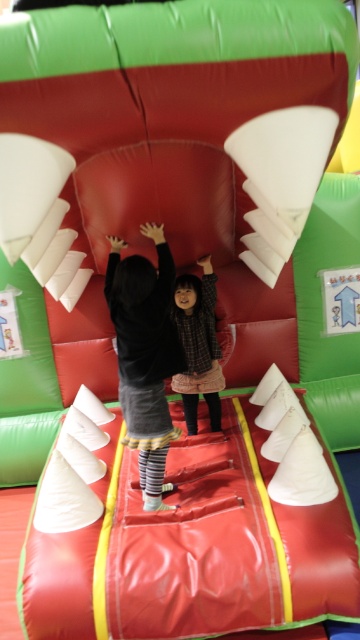
Question: Is black fleece jacket at center bigger than plaid fabric dress at center?

Choices:
 (A) yes
 (B) no

Answer: (A)

Question: Which point appears closest to the camera in this image?

Choices:
 (A) pos(144,378)
 (B) pos(212,324)

Answer: (A)

Question: Is black fleece jacket at center below plaid fabric dress at center?

Choices:
 (A) no
 (B) yes

Answer: (B)

Question: Can you confirm if black fleece jacket at center is thinner than plaid fabric dress at center?

Choices:
 (A) yes
 (B) no

Answer: (B)